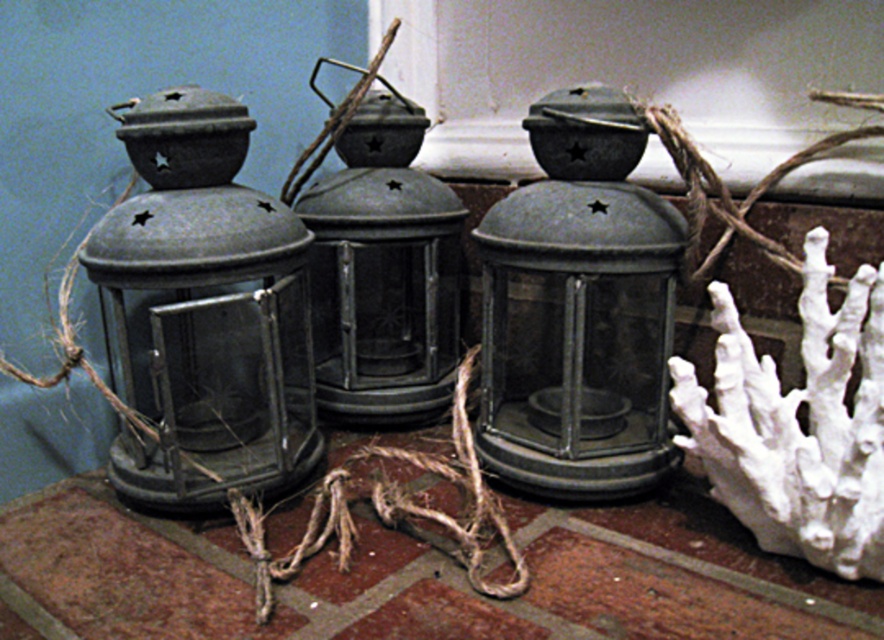
Who is more forward, (165, 257) or (380, 221)?

Positioned in front is point (165, 257).

Can you confirm if matte black lantern at left is positioned to the right of matte metal lantern at center?

In fact, matte black lantern at left is to the left of matte metal lantern at center.

Which is behind, point (128, 490) or point (378, 269)?

Point (378, 269)

At what (x,y) coordinates should I click in order to perform the action: click on matte black lantern at left. Please return your answer as a coordinate pair (x, y). Looking at the image, I should click on (204, 310).

Can you confirm if matte black lantern at left is shorter than rustic twine at center?

Incorrect, matte black lantern at left's height does not fall short of rustic twine at center's.

Is matte black lantern at left further to the viewer compared to rustic twine at center?

Yes.

Is point (265, 394) closer to viewer compared to point (257, 568)?

No, (265, 394) is further to viewer.

At what (x,y) coordinates should I click in order to perform the action: click on matte black lantern at left. Please return your answer as a coordinate pair (x, y). Image resolution: width=884 pixels, height=640 pixels. Looking at the image, I should click on click(204, 310).

Is point (387, 392) positioned in front of point (246, 552)?

No, it is behind (246, 552).

Does matte metal lantern at center appear over rustic twine at center?

Correct, matte metal lantern at center is located above rustic twine at center.

Find the location of `matte metal lantern at center`. matte metal lantern at center is located at coordinates (383, 273).

You are a GUI agent. You are given a task and a screenshot of the screen. Output one action in this format:
    pyautogui.click(x=<x>, y=<y>)
    Task: Click on the matte metal lantern at center
    This screenshot has height=640, width=884.
    Given the screenshot: What is the action you would take?
    pyautogui.click(x=383, y=273)